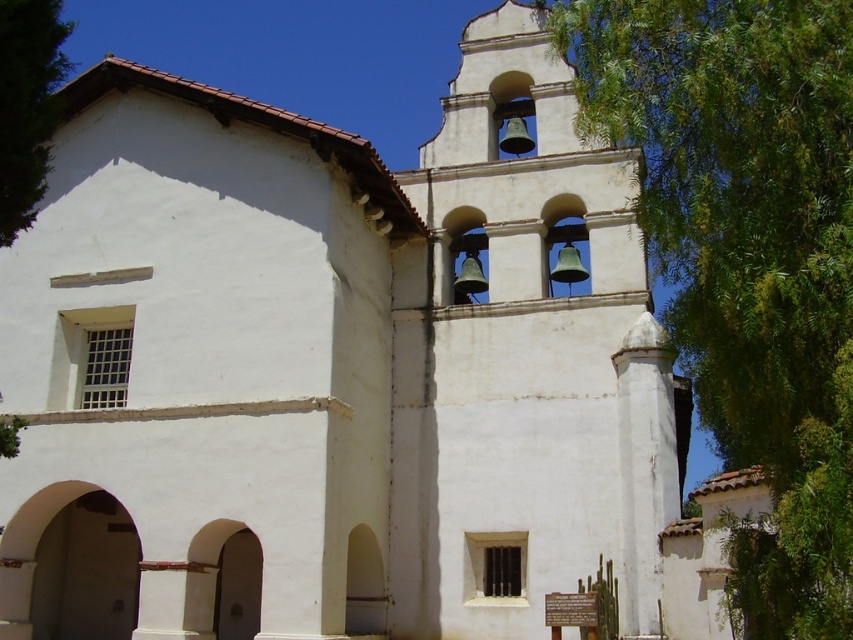
Who is taller, green leafy tree at upper right or green leafy tree at upper left?

Standing taller between the two is green leafy tree at upper right.

Who is shorter, green leafy tree at upper right or green leafy tree at upper left?

Standing shorter between the two is green leafy tree at upper left.

I want to click on green leafy tree at upper right, so click(x=747, y=257).

This screenshot has width=853, height=640. I want to click on green leafy tree at upper right, so click(747, 257).